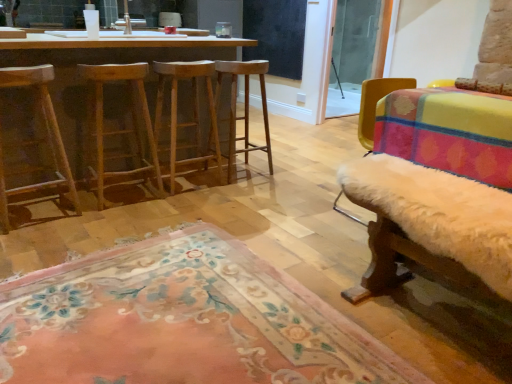
Question: Is black matte window screen at upper center not close to wooden stool at left?

Choices:
 (A) yes
 (B) no

Answer: (A)

Question: Can you confirm if black matte window screen at upper center is positioned to the left of wooden stool at left?

Choices:
 (A) no
 (B) yes

Answer: (A)

Question: Is black matte window screen at upper center at the right side of wooden stool at left?

Choices:
 (A) no
 (B) yes

Answer: (B)

Question: Would you say wooden stool at left is part of black matte window screen at upper center's contents?

Choices:
 (A) no
 (B) yes

Answer: (A)

Question: Considering the relative sizes of black matte window screen at upper center and wooden stool at left in the image provided, is black matte window screen at upper center bigger than wooden stool at left?

Choices:
 (A) no
 (B) yes

Answer: (A)

Question: From the image's perspective, is light brown wood stool at center, which is the 2th stool in right-to-left order, above or below transparent glass screen door at upper right?

Choices:
 (A) above
 (B) below

Answer: (B)

Question: In terms of height, does light brown wood stool at center, the second stool positioned from the left, look taller or shorter compared to transparent glass screen door at upper right?

Choices:
 (A) tall
 (B) short

Answer: (B)

Question: Is light brown wood stool at center, which is the 2th stool in right-to-left order, to the left or to the right of transparent glass screen door at upper right in the image?

Choices:
 (A) left
 (B) right

Answer: (A)

Question: Is light brown wood stool at center, which is the 2th stool in right-to-left order, bigger or smaller than transparent glass screen door at upper right?

Choices:
 (A) small
 (B) big

Answer: (B)

Question: Considering the positions of point (71, 130) and point (15, 345), is point (71, 130) closer or farther from the camera than point (15, 345)?

Choices:
 (A) farther
 (B) closer

Answer: (A)

Question: In terms of width, does wooden barstools at left look wider or thinner when compared to floral rug at lower center?

Choices:
 (A) thin
 (B) wide

Answer: (A)

Question: From the image's perspective, is wooden barstools at left positioned above or below floral rug at lower center?

Choices:
 (A) above
 (B) below

Answer: (A)

Question: Is wooden barstools at left to the left or to the right of floral rug at lower center in the image?

Choices:
 (A) left
 (B) right

Answer: (A)

Question: Based on their positions, is black matte window screen at upper center located to the left or right of transparent glass screen door at upper right?

Choices:
 (A) right
 (B) left

Answer: (B)

Question: Would you say black matte window screen at upper center is inside or outside transparent glass screen door at upper right?

Choices:
 (A) inside
 (B) outside

Answer: (B)